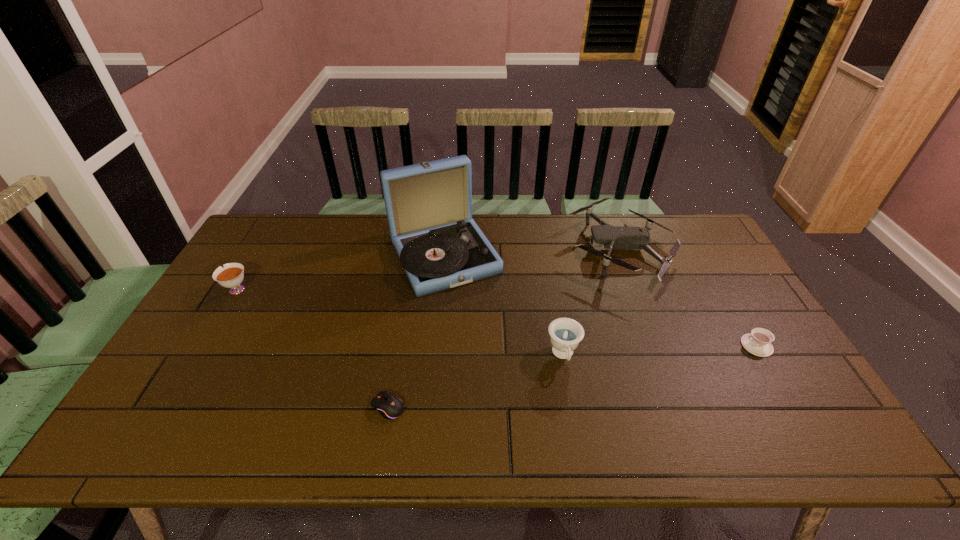
Find the location of a particular element. object that is the fourth closest to the fourth object from left to right is located at coordinates (758, 342).

Locate an element on the screen. the third closest object to the farthest teacup is located at coordinates (565, 334).

Locate which teacup is the closest to the nearest object. Please provide its 2D coordinates. Your answer should be formatted as a tuple, i.e. [(x, y)], where the tuple contains the x and y coordinates of a point satisfying the conditions above.

[(565, 334)]

Identify which teacup is the closest to the phonograph record. Please provide its 2D coordinates. Your answer should be formatted as a tuple, i.e. [(x, y)], where the tuple contains the x and y coordinates of a point satisfying the conditions above.

[(565, 334)]

You are a GUI agent. You are given a task and a screenshot of the screen. Output one action in this format:
    pyautogui.click(x=<x>, y=<y>)
    Task: Click on the vacant space that satisfies the following two spatial constraints: 1. on the front-facing side of the fifth object from left to right; 2. on the side of the fourth object from left to right with the handle
    
    Given the screenshot: What is the action you would take?
    pyautogui.click(x=660, y=355)

The width and height of the screenshot is (960, 540). I want to click on free spot that satisfies the following two spatial constraints: 1. on the handle side of the rightmost object; 2. on the side of the third object from right to left with the handle, so click(762, 355).

The width and height of the screenshot is (960, 540). What are the coordinates of `vacant space that satisfies the following two spatial constraints: 1. on the handle side of the second shortest object; 2. on the side of the second teacup from right to left with the handle` in the screenshot? It's located at (762, 355).

At what (x,y) coordinates should I click in order to perform the action: click on vacant space that satisfies the following two spatial constraints: 1. on the side of the shortest object with the handle; 2. on the left side of the leftmost object. Please return your answer as a coordinate pair (x, y). Looking at the image, I should click on (165, 407).